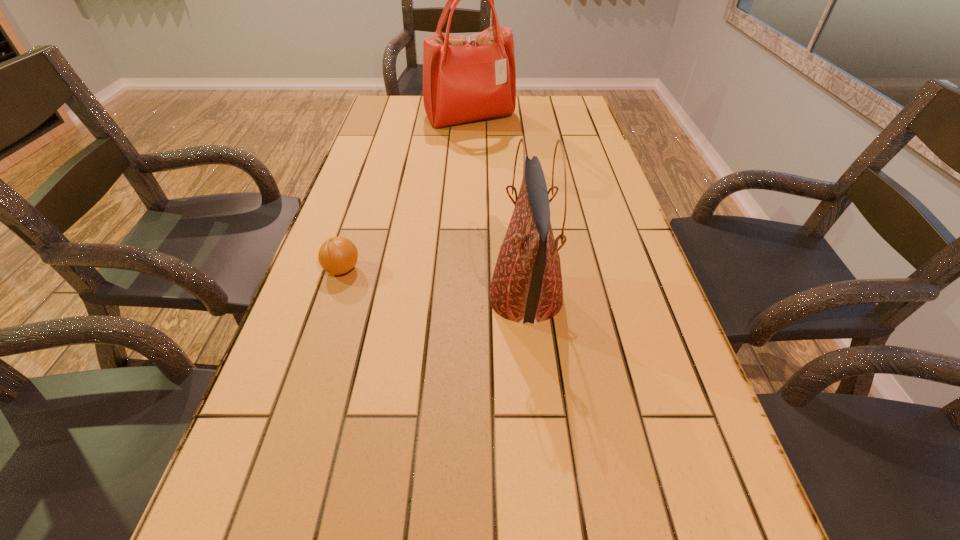
I want to click on object that can be found as the second closest to the taller handbag, so click(526, 286).

Find the location of a particular element. This screenshot has height=540, width=960. free space that satisfies the following two spatial constraints: 1. on the front-facing side of the farthest object; 2. on the right side of the shorter handbag is located at coordinates (464, 298).

At what (x,y) coordinates should I click in order to perform the action: click on free space in the image that satisfies the following two spatial constraints: 1. on the front-facing side of the tallest object; 2. on the left side of the nearer handbag. Please return your answer as a coordinate pair (x, y). The width and height of the screenshot is (960, 540). Looking at the image, I should click on (464, 298).

The width and height of the screenshot is (960, 540). I want to click on free spot that satisfies the following two spatial constraints: 1. on the front-facing side of the farthest object; 2. on the left side of the shorter handbag, so click(464, 298).